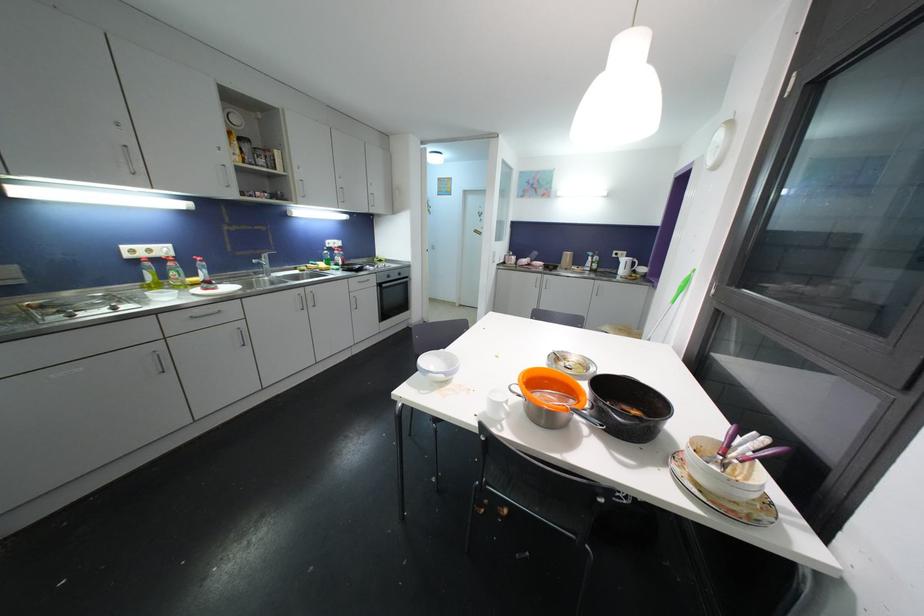
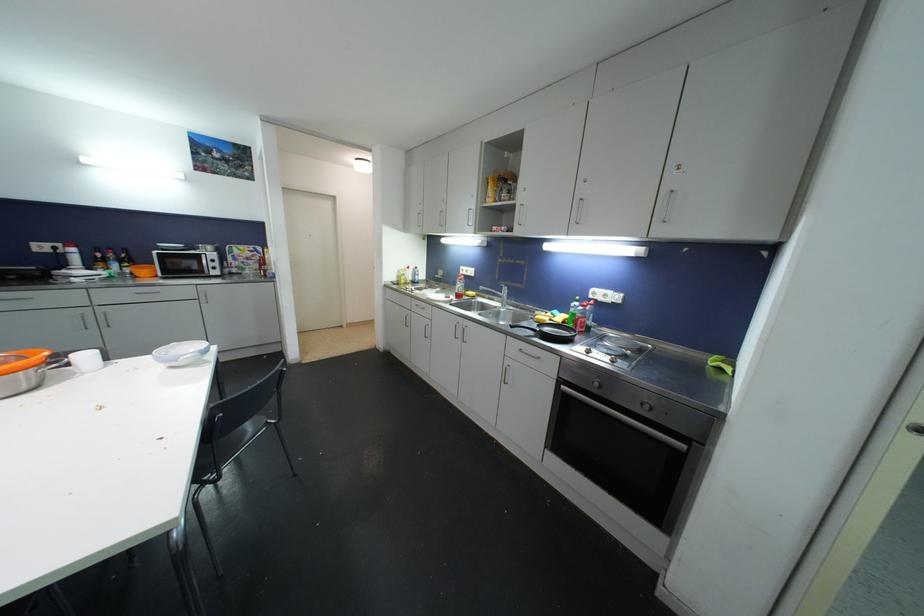
Find the pixel in the second image that matches [241,256] in the first image.

(504, 285)